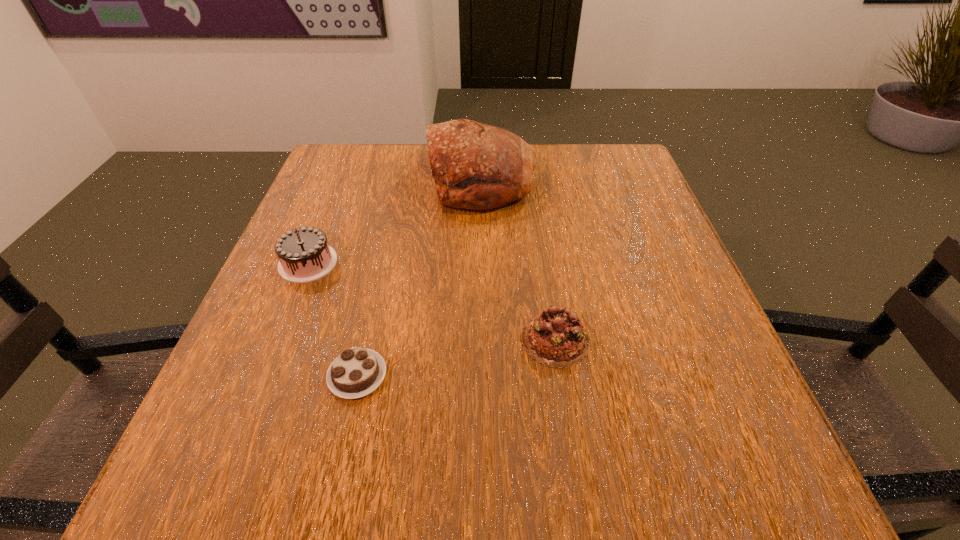
Locate an element on the screen. The width and height of the screenshot is (960, 540). free region located 0.080m at the sliced front of the tallest object is located at coordinates (396, 181).

Identify the location of vacant region located 0.400m on the back of the second tallest object. (354, 148).

Identify the location of vacant space situated on the left of the third tallest object. This screenshot has width=960, height=540. (314, 340).

This screenshot has width=960, height=540. In order to click on vacant space situated on the right of the shortest chocolate cake in this screenshot , I will do `click(551, 375)`.

At what (x,y) coordinates should I click in order to perform the action: click on object that is at the far edge. Please return your answer as a coordinate pair (x, y). Looking at the image, I should click on (476, 166).

I want to click on object that is positioned at the left edge, so click(x=304, y=255).

In the image, there is a desktop. Identify the location of vacant space at the far edge. (539, 193).

I want to click on free location at the near edge, so click(559, 443).

At what (x,y) coordinates should I click in order to perform the action: click on vacant region at the left edge of the desktop. Please return your answer as a coordinate pair (x, y). Looking at the image, I should click on (327, 289).

Where is `vacant region at the right edge of the desktop`? This screenshot has width=960, height=540. vacant region at the right edge of the desktop is located at coordinates (680, 279).